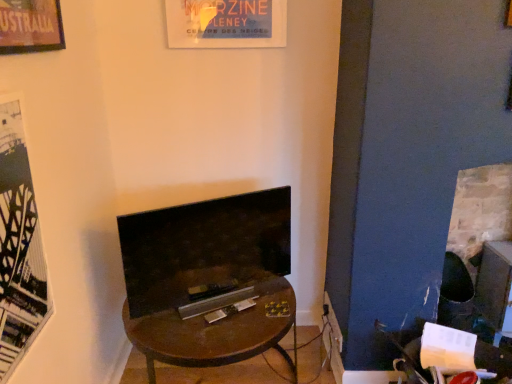
This screenshot has width=512, height=384. Find the location of `free spot below matte black tv at center, which is counted as the first fireplace, starting from the left (from a real-world perspective)`. free spot below matte black tv at center, which is counted as the first fireplace, starting from the left (from a real-world perspective) is located at coordinates (218, 295).